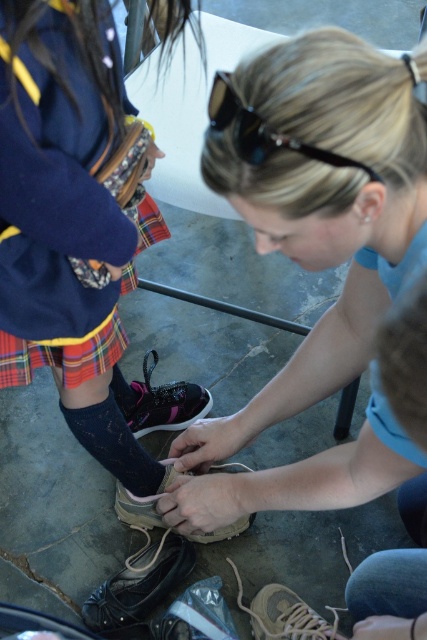
You are a teacher observing a child and an adult in the schoolyard. You notice the pink suede sneaker at center and the light brown suede sneaker at lower center. Which shoe is positioned higher in the image?

The pink suede sneaker at center is positioned higher than the light brown suede sneaker at lower center in the image.